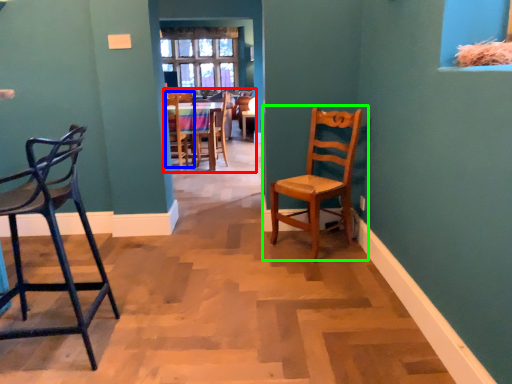
Question: Which is nearer to the chair (highlighted by a red box)? chair (highlighted by a blue box) or chair (highlighted by a green box).

Choices:
 (A) chair
 (B) chair

Answer: (A)